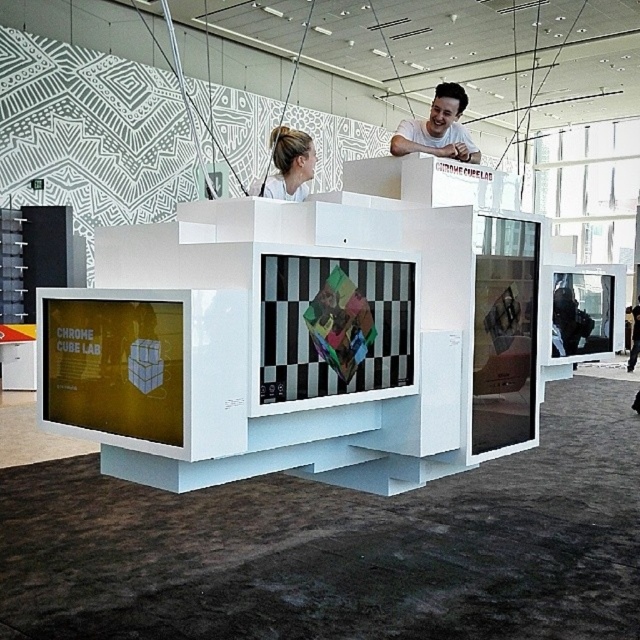
You are a visitor at the Chrome Cube Lab exhibit and notice two objects at the upper center of the display. They are the matte white shirt at upper center and the white matte hair at upper center. Which one appears shorter in the image?

The matte white shirt at upper center is shorter than the white matte hair at upper center according to the description.

You are an artist planning to photograph the central structure of the Chrome Cube Lab exhibit. You notice the matte white shirt at upper center and the white matte hair at upper center in your frame. Which object should you adjust your camera angle to prioritize focusing on, considering their spatial relationship?

The white matte hair at upper center is behind the matte white shirt at upper center, so you should focus on the matte white shirt at upper center to ensure it remains the primary subject in the foreground.